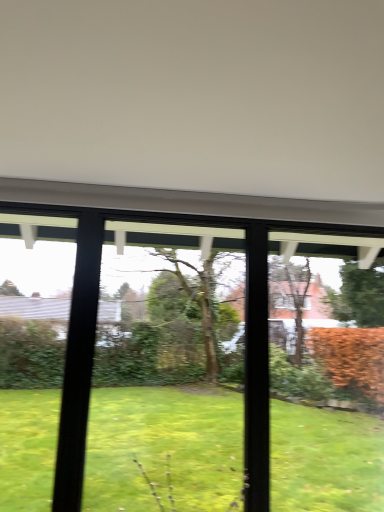
Identify the location of empty space that is ontop of transparent glass window at center (from a real-world perspective). The height and width of the screenshot is (512, 384). (188, 215).